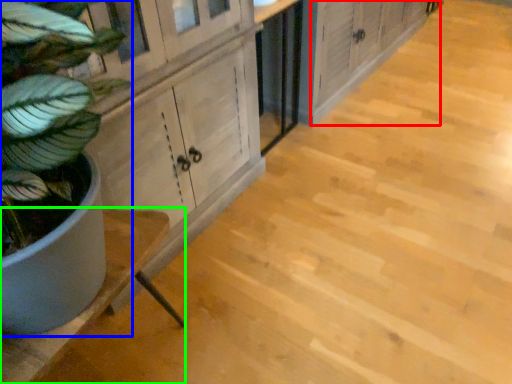
Question: Estimate the real-world distances between objects in this image. Which object is closer to cabinetry (highlighted by a red box), houseplant (highlighted by a blue box) or counter (highlighted by a green box)?

Choices:
 (A) houseplant
 (B) counter

Answer: (B)